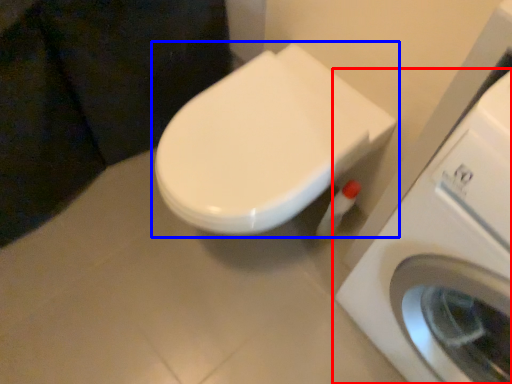
Question: Which object appears closest to the camera in this image, washing machine (highlighted by a red box) or toilet (highlighted by a blue box)?

Choices:
 (A) washing machine
 (B) toilet

Answer: (A)